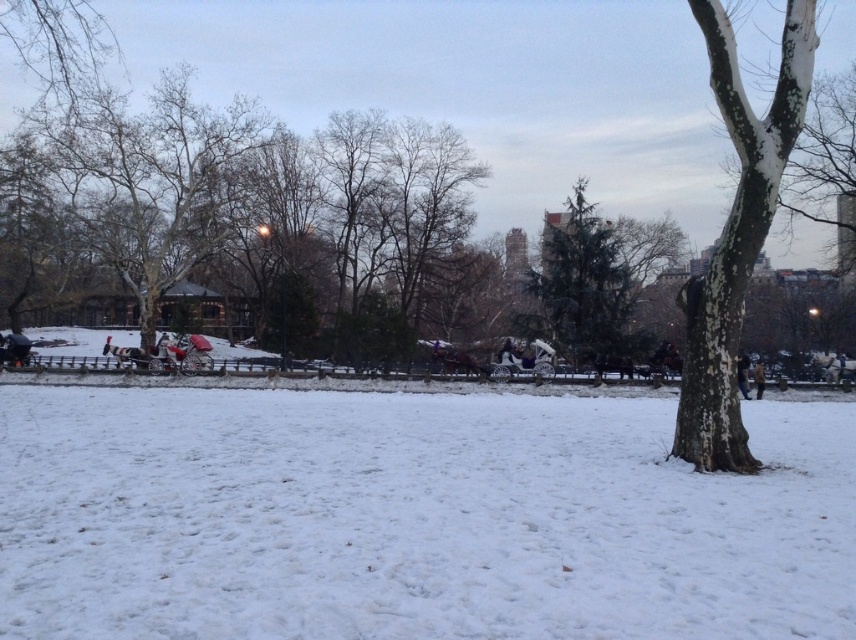
Question: Is green textured tree at center positioned behind dark brown leather coat at center?

Choices:
 (A) no
 (B) yes

Answer: (B)

Question: Which object appears closest to the camera in this image?

Choices:
 (A) smooth bark tree at left
 (B) brown leather jacket at lower right
 (C) green textured tree at center

Answer: (B)

Question: Which point is farther to the camera?

Choices:
 (A) green textured tree at center
 (B) white textured bark at center
 (C) dark brown leather coat at center

Answer: (A)

Question: Does smooth bark tree at left have a lesser width compared to white textured bark at center?

Choices:
 (A) no
 (B) yes

Answer: (A)

Question: Which object is positioned closest to the green textured tree at center?

Choices:
 (A) brown leather jacket at lower right
 (B) dark brown leather coat at center

Answer: (B)

Question: Can you confirm if white fluffy snow at center is smaller than green textured tree at center?

Choices:
 (A) yes
 (B) no

Answer: (A)